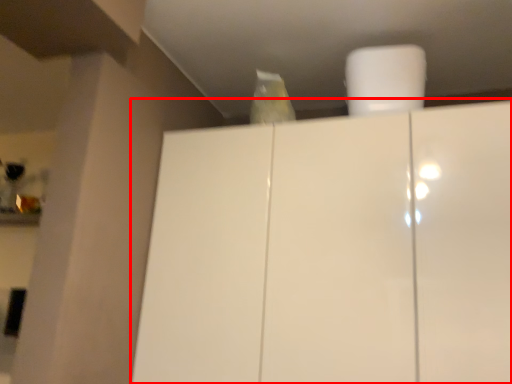
Question: From the image's perspective, what is the correct spatial relationship of cupboard (annotated by the red box) in relation to paper towel?

Choices:
 (A) below
 (B) above

Answer: (A)